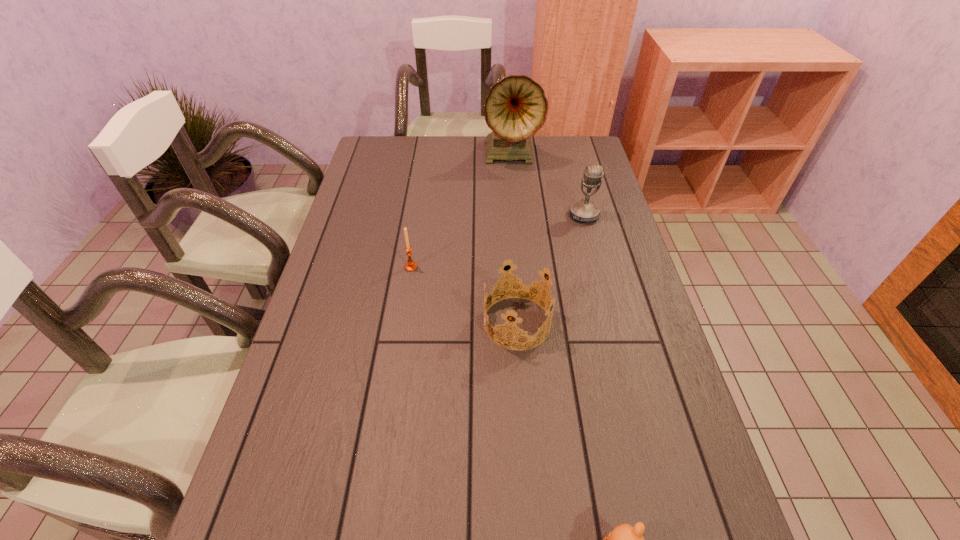
Identify the location of the farthest object. (515, 108).

The height and width of the screenshot is (540, 960). In order to click on the tallest object in this screenshot , I will do `click(515, 108)`.

Image resolution: width=960 pixels, height=540 pixels. I want to click on the second farthest object, so click(x=582, y=211).

Locate an element on the screen. The image size is (960, 540). microphone is located at coordinates (582, 211).

I want to click on the leftmost object, so click(x=411, y=266).

Find the location of a particular element. candle_holder is located at coordinates (411, 266).

The height and width of the screenshot is (540, 960). In order to click on the fourth farthest object in this screenshot , I will do `click(523, 278)`.

The width and height of the screenshot is (960, 540). In order to click on vacant space situated from the horn of the tallest object in this screenshot , I will do [514, 186].

The image size is (960, 540). I want to click on free region located on the front-facing side of the second tallest object, so click(607, 300).

Identify the location of vacant area located on the front of the candle_holder. The width and height of the screenshot is (960, 540). (407, 296).